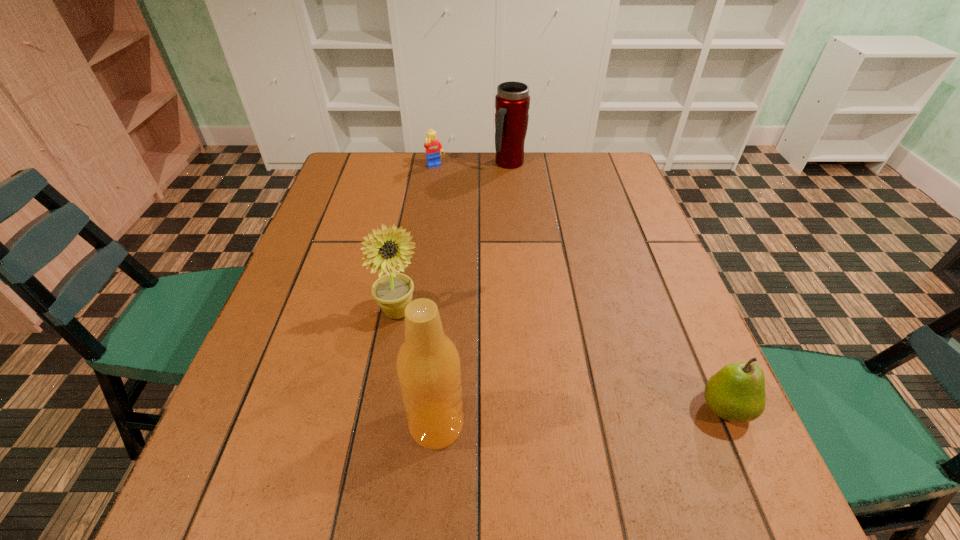
Identify the location of object present at the right edge. (736, 392).

At what (x,y) coordinates should I click in order to perform the action: click on object located at the near right corner. Please return your answer as a coordinate pair (x, y). The height and width of the screenshot is (540, 960). Looking at the image, I should click on (736, 392).

At what (x,y) coordinates should I click in order to perform the action: click on blank space at the far edge of the desktop. Please return your answer as a coordinate pair (x, y). The height and width of the screenshot is (540, 960). Looking at the image, I should click on (537, 157).

Where is `free space at the left edge of the desktop`? Image resolution: width=960 pixels, height=540 pixels. free space at the left edge of the desktop is located at coordinates (341, 250).

The height and width of the screenshot is (540, 960). In order to click on blank space at the far left corner in this screenshot , I will do `click(372, 183)`.

Find the location of a particular element. Image resolution: width=960 pixels, height=540 pixels. vacant space at the near left corner is located at coordinates (281, 438).

Find the location of a particular element. The width and height of the screenshot is (960, 540). free space at the far right corner of the desktop is located at coordinates (597, 163).

Find the location of `free space between the Lego and the third nearest object`. free space between the Lego and the third nearest object is located at coordinates pos(418,239).

The height and width of the screenshot is (540, 960). Identify the location of free space that is in between the Lego and the second object from right to left. (472, 165).

This screenshot has height=540, width=960. Identify the location of vacant region between the fourth object from left to right and the Lego. (472, 165).